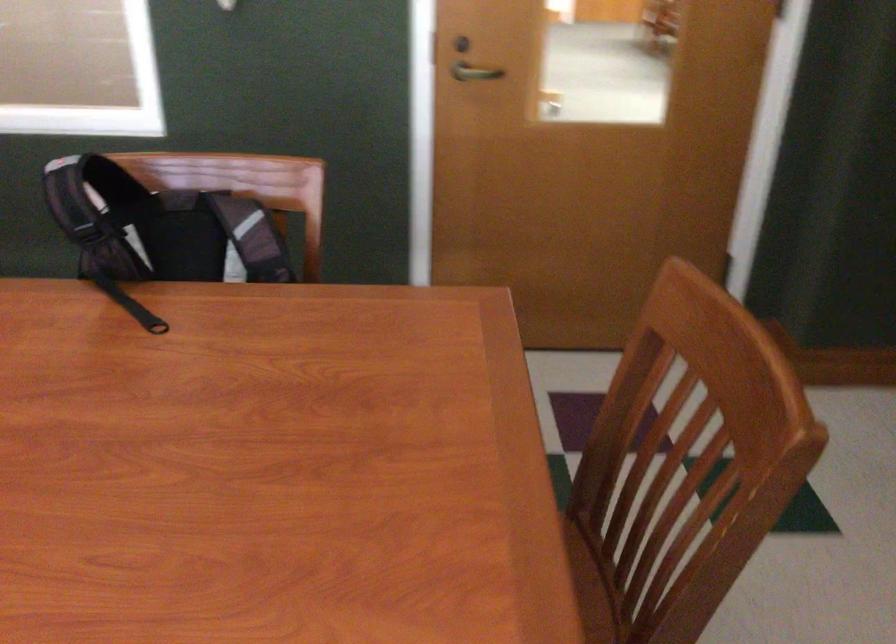
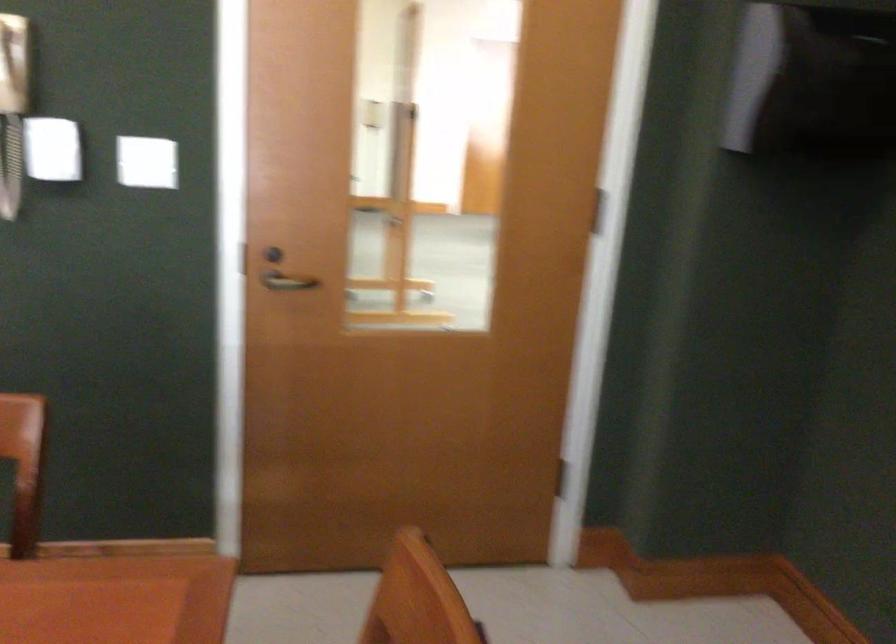
Which direction would the cameraman need to move to produce the second image?

The movement direction of the cameraman is right, forward.